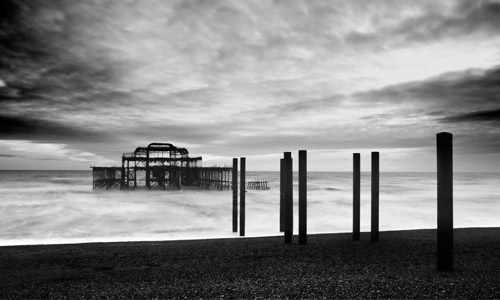
The height and width of the screenshot is (300, 500). What are the coordinates of `bars` in the screenshot? It's located at (142, 156).